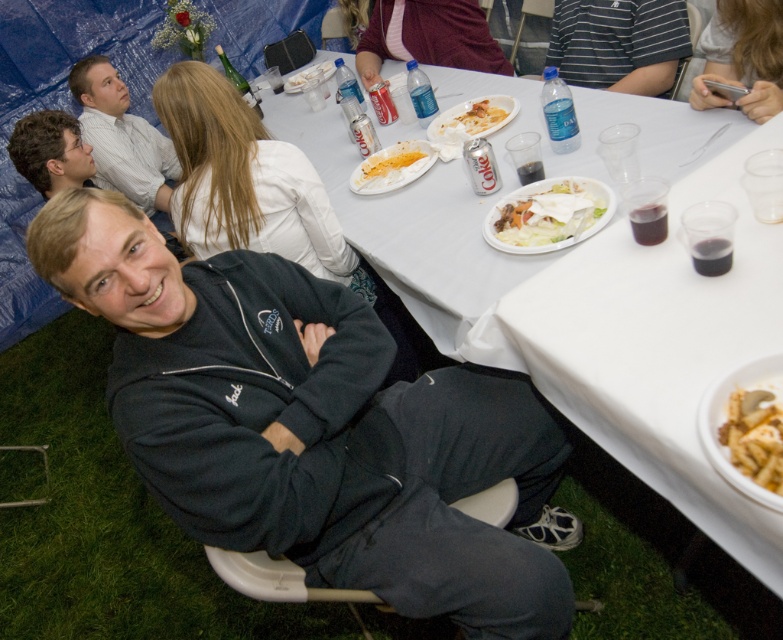
You are attending a picnic and see two pastas on the table. The white creamy pasta at center and the yellowish matte pasta at lower right. Which one is taller?

The white creamy pasta at center is taller than the yellowish matte pasta at lower right.

You are a photographer standing at the edge of the artificial grass where the picnic is set up. You want to take a photo of the white creamy pasta at center so that it appears centered in your frame. Based on its coordinates, where should you aim your camera?

The white creamy pasta at center is located at coordinates point (547, 214). To center it in your photo, aim your camera so that the crosshairs align with those coordinates.